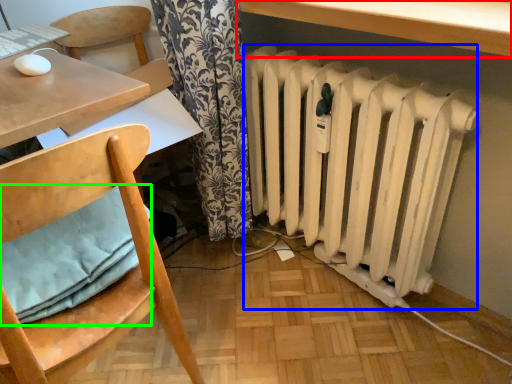
Question: Estimate the real-world distances between objects in this image. Which object is closer to table (highlighted by a red box), radiator (highlighted by a blue box) or pillow (highlighted by a green box)?

Choices:
 (A) radiator
 (B) pillow

Answer: (A)